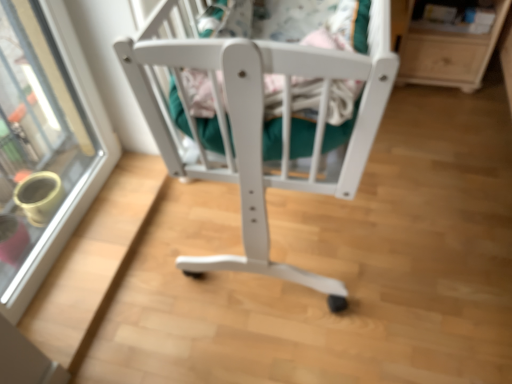
Locate an element on the screen. vacant area that is in front of light wood/texture shelf at upper right is located at coordinates (448, 113).